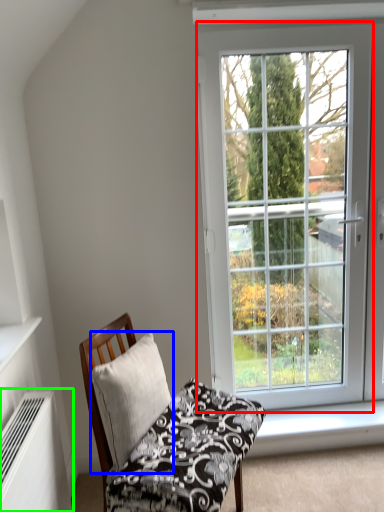
Question: Which object is positioned closest to window (highlighted by a red box)? Select from pillow (highlighted by a blue box) and air conditioner (highlighted by a green box).

Choices:
 (A) pillow
 (B) air conditioner

Answer: (A)